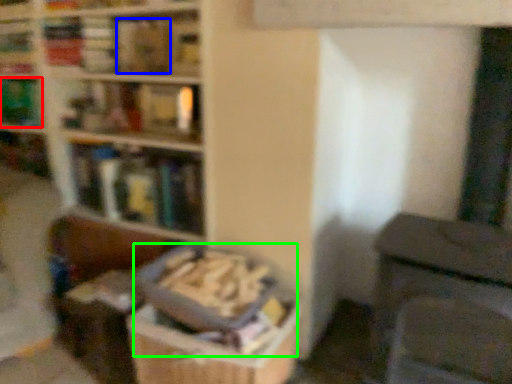
Question: Which object is the farthest from book (highlighted by a red box)? Choose among these: book (highlighted by a blue box) or book (highlighted by a green box).

Choices:
 (A) book
 (B) book

Answer: (B)